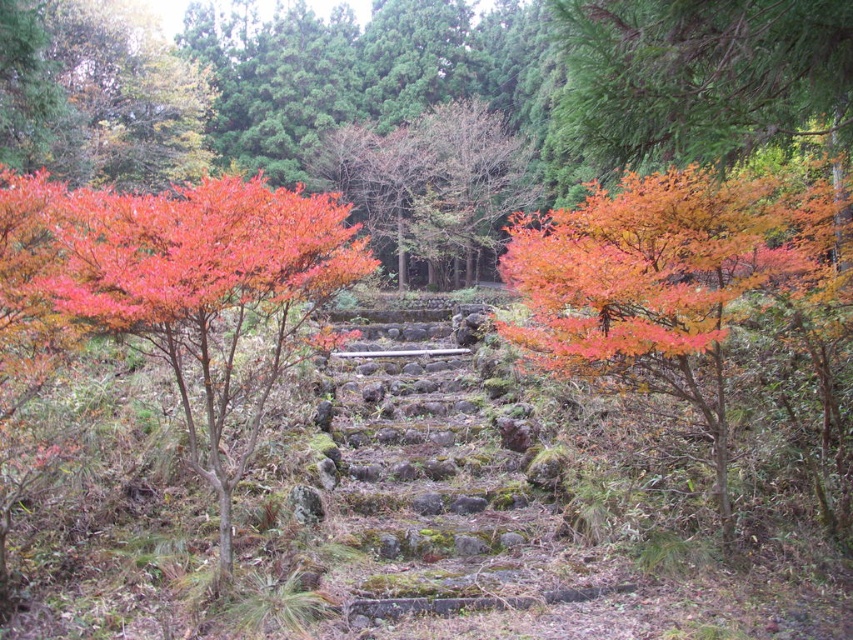
Which is above, shiny orange maple at center or shiny red maple tree at left?

shiny red maple tree at left is above.

The image size is (853, 640). In order to click on shiny orange maple at center in this screenshot , I will do `click(691, 298)`.

The image size is (853, 640). What are the coordinates of `shiny orange maple at center` in the screenshot? It's located at (691, 298).